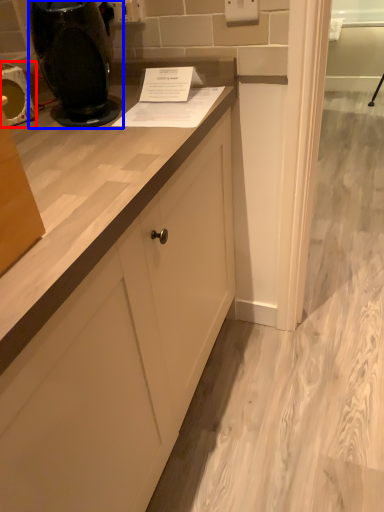
Question: Which of the following is the closest to the observer, appliance (highlighted by a red box) or home appliance (highlighted by a blue box)?

Choices:
 (A) appliance
 (B) home appliance

Answer: (B)